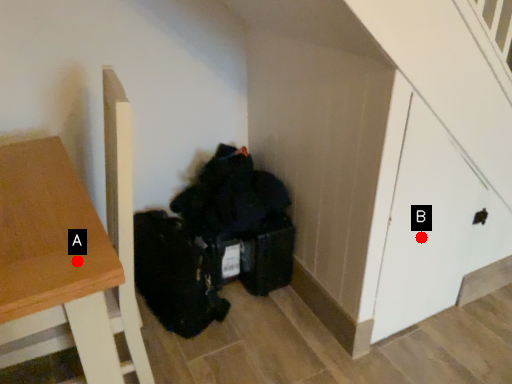
Question: Two points are circled on the image, labeled by A and B beside each circle. Which point appears closest to the camera in this image?

Choices:
 (A) A is closer
 (B) B is closer

Answer: (A)